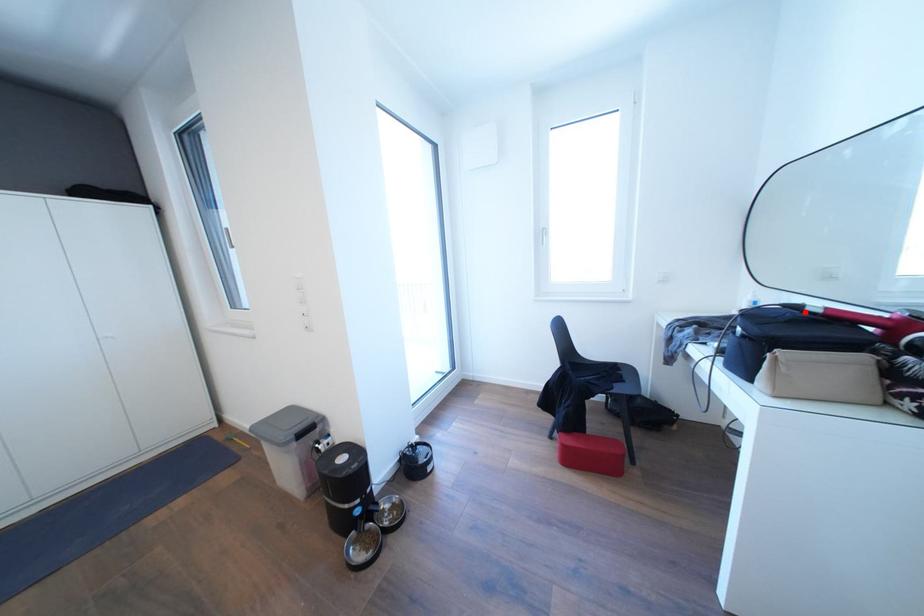
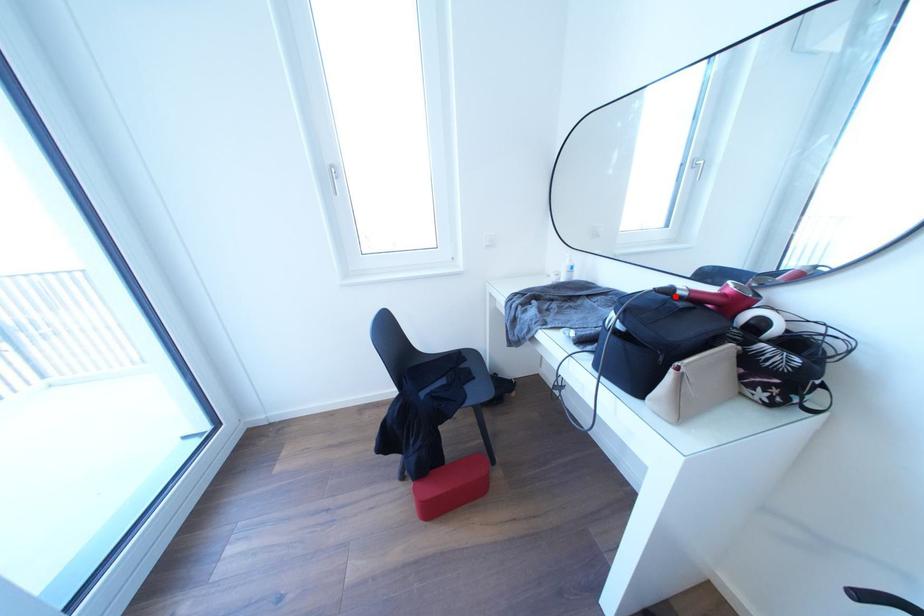
I am providing you with two images of the same scene from different viewpoints. A red point is marked on the first image and another point is marked on the second image. Do the highlighted points in image1 and image2 indicate the same real-world spot?

Yes